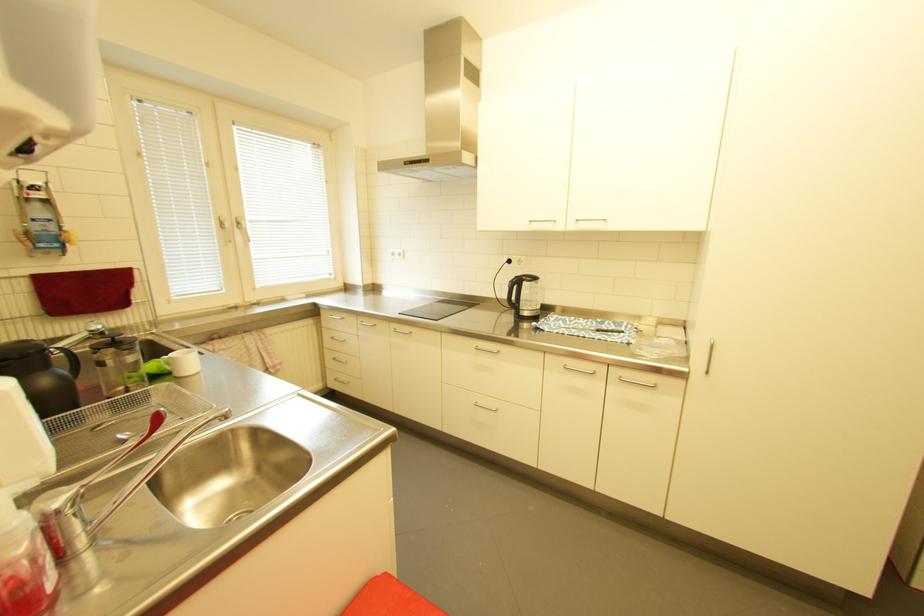
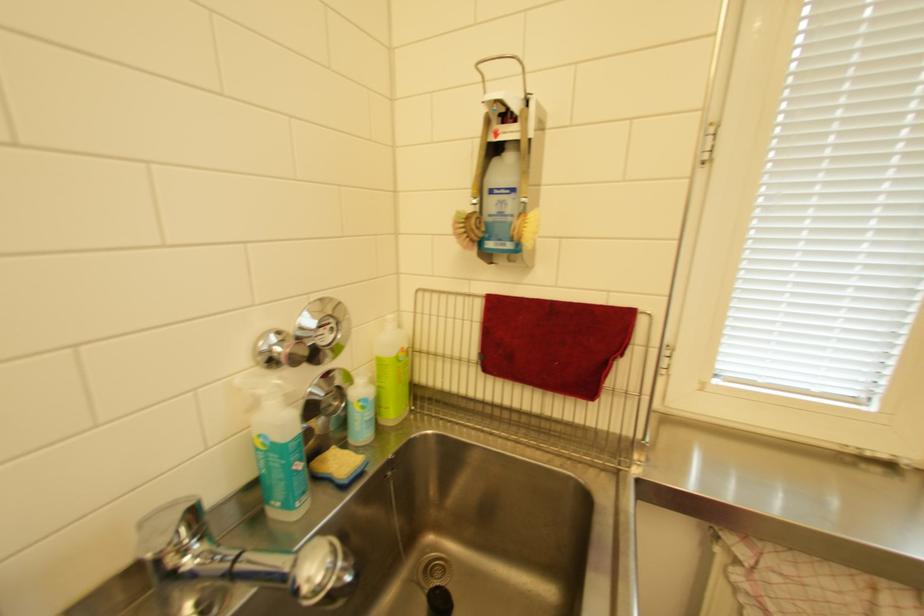
The point at (34,233) is marked in the first image. Where is the corresponding point in the second image?

(475, 217)